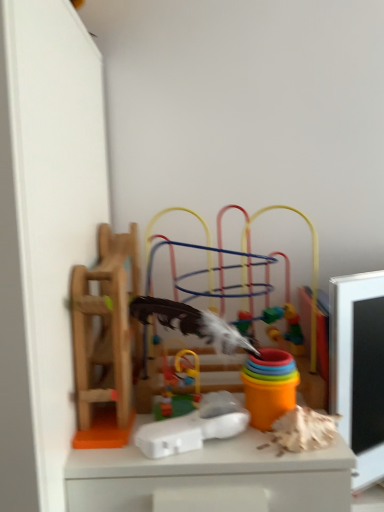
Question: Can you confirm if multicolored plastic toy at center, acting as the 4th toy starting from the left, is wider than white plastic toy at center, which ranks as the 2th toy in right-to-left order?

Choices:
 (A) yes
 (B) no

Answer: (A)

Question: Is multicolored plastic toy at center, the first toy viewed from the right, in contact with white plastic toy at center, which ranks as the 2th toy in right-to-left order?

Choices:
 (A) no
 (B) yes

Answer: (A)

Question: Is multicolored plastic toy at center, acting as the 4th toy starting from the left, positioned behind white plastic toy at center, which ranks as the 2th toy in right-to-left order?

Choices:
 (A) no
 (B) yes

Answer: (B)

Question: Is multicolored plastic toy at center, the first toy viewed from the right, oriented towards white plastic toy at center, which ranks as the third toy in left-to-right order?

Choices:
 (A) yes
 (B) no

Answer: (A)

Question: From a real-world perspective, is multicolored plastic toy at center, acting as the 4th toy starting from the left, over white plastic toy at center, which ranks as the 2th toy in right-to-left order?

Choices:
 (A) no
 (B) yes

Answer: (B)

Question: Considering the positions of wooden ladder at left, which is the fourth toy from right to left, and rubberized plastic toy at center, which is the third toy from right to left, in the image, is wooden ladder at left, which is the fourth toy from right to left, taller or shorter than rubberized plastic toy at center, which is the third toy from right to left,?

Choices:
 (A) tall
 (B) short

Answer: (A)

Question: Which is correct: wooden ladder at left, which is the fourth toy from right to left, is inside rubberized plastic toy at center, which appears as the 2th toy when viewed from the left, or outside of it?

Choices:
 (A) inside
 (B) outside

Answer: (B)

Question: Is wooden ladder at left, placed as the 1th toy when sorted from left to right, wider or thinner than rubberized plastic toy at center, which appears as the 2th toy when viewed from the left?

Choices:
 (A) thin
 (B) wide

Answer: (B)

Question: Based on their positions, is wooden ladder at left, placed as the 1th toy when sorted from left to right, located to the left or right of rubberized plastic toy at center, which appears as the 2th toy when viewed from the left?

Choices:
 (A) left
 (B) right

Answer: (A)

Question: In the image, is white plastic toy at center, which ranks as the third toy in left-to-right order, on the left side or the right side of rubberized plastic toy at center, which is the third toy from right to left?

Choices:
 (A) right
 (B) left

Answer: (A)

Question: Considering the positions of point (225, 415) and point (157, 399), is point (225, 415) closer or farther from the camera than point (157, 399)?

Choices:
 (A) closer
 (B) farther

Answer: (A)

Question: From the image's perspective, relative to rubberized plastic toy at center, which is the third toy from right to left, is white plastic toy at center, which ranks as the 2th toy in right-to-left order, above or below?

Choices:
 (A) above
 (B) below

Answer: (B)

Question: Is white plastic toy at center, which ranks as the 2th toy in right-to-left order, spatially inside rubberized plastic toy at center, which is the third toy from right to left, or outside of it?

Choices:
 (A) inside
 (B) outside

Answer: (B)

Question: From their relative heights in the image, would you say wooden ladder at left, placed as the 1th toy when sorted from left to right, is taller or shorter than white plastic toy at center, which ranks as the third toy in left-to-right order?

Choices:
 (A) short
 (B) tall

Answer: (B)

Question: From the image's perspective, is wooden ladder at left, which is the fourth toy from right to left, located above or below white plastic toy at center, which ranks as the third toy in left-to-right order?

Choices:
 (A) below
 (B) above

Answer: (B)